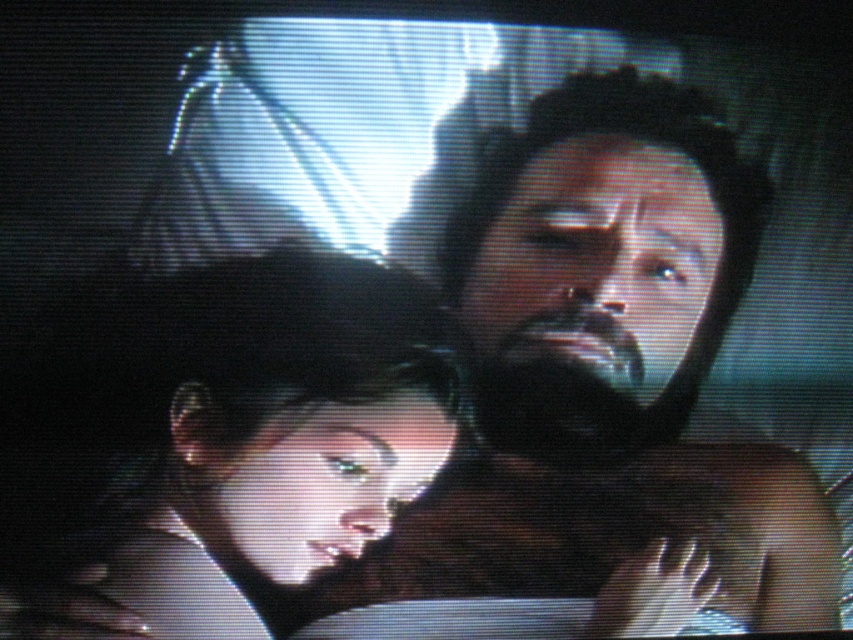
Does point (767, 600) come farther from viewer compared to point (279, 579)?

That is True.

From the picture: Is dark brown hair at center wider than smooth skin face at center?

Yes, dark brown hair at center is wider than smooth skin face at center.

Locate an element on the screen. dark brown hair at center is located at coordinates (606, 380).